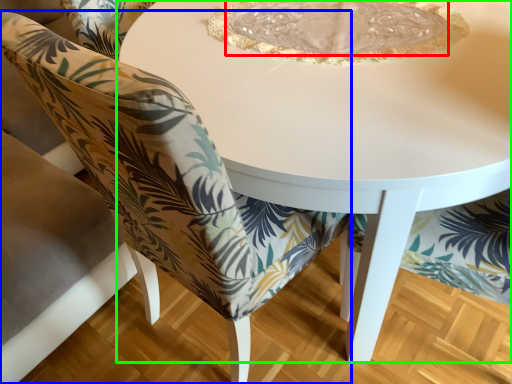
Question: Based on their relative distances, which object is nearer to glass plate (highlighted by a red box)? Choose from chair (highlighted by a blue box) and table (highlighted by a green box).

Choices:
 (A) chair
 (B) table

Answer: (B)